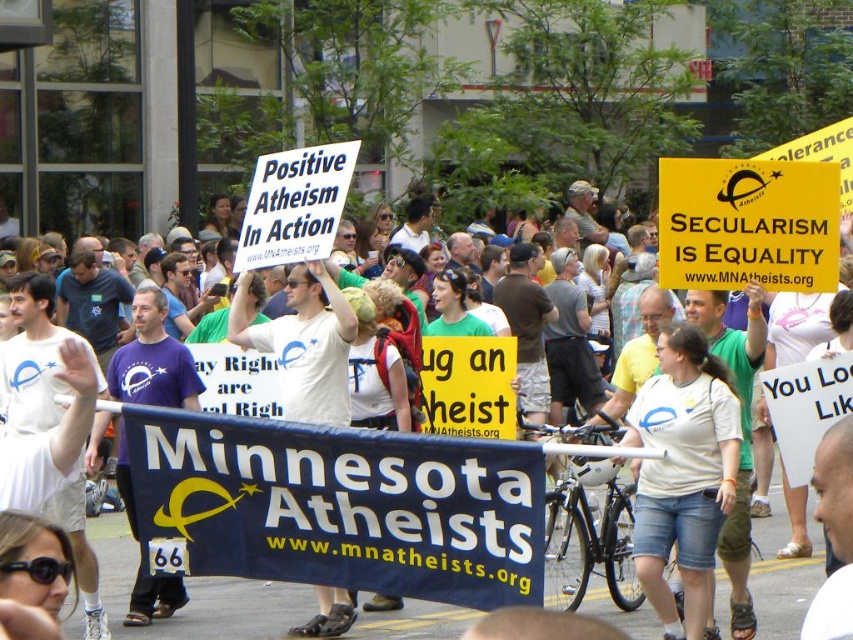
Question: Which object is farther from the camera taking this photo?

Choices:
 (A) yellow paper sign at center
 (B) white paper sign at upper center

Answer: (B)

Question: Can you confirm if yellow paper sign at center is wider than white paper sign at upper center?

Choices:
 (A) yes
 (B) no

Answer: (A)

Question: Which point is farther to the camera?

Choices:
 (A) yellow paper sign at center
 (B) white matte t-shirt at center
 (C) white paper sign at upper center

Answer: (C)

Question: Can you confirm if white matte t-shirt at center is positioned to the left of white paper sign at upper center?

Choices:
 (A) no
 (B) yes

Answer: (A)

Question: Among these points, which one is nearest to the camera?

Choices:
 (A) (746, 250)
 (B) (660, 584)

Answer: (B)

Question: Can you confirm if yellow paper sign at center is positioned above white paper sign at upper center?

Choices:
 (A) yes
 (B) no

Answer: (A)